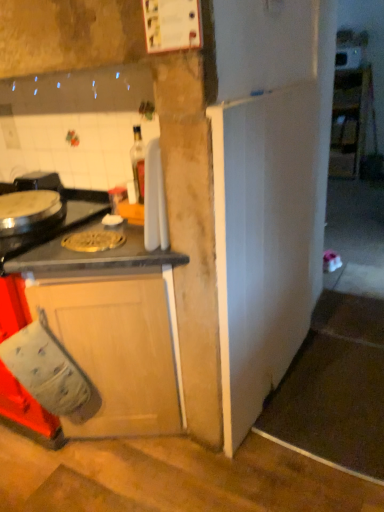
This screenshot has height=512, width=384. I want to click on free space above gold metallic pizza pan at center (from a real-world perspective), so click(x=99, y=234).